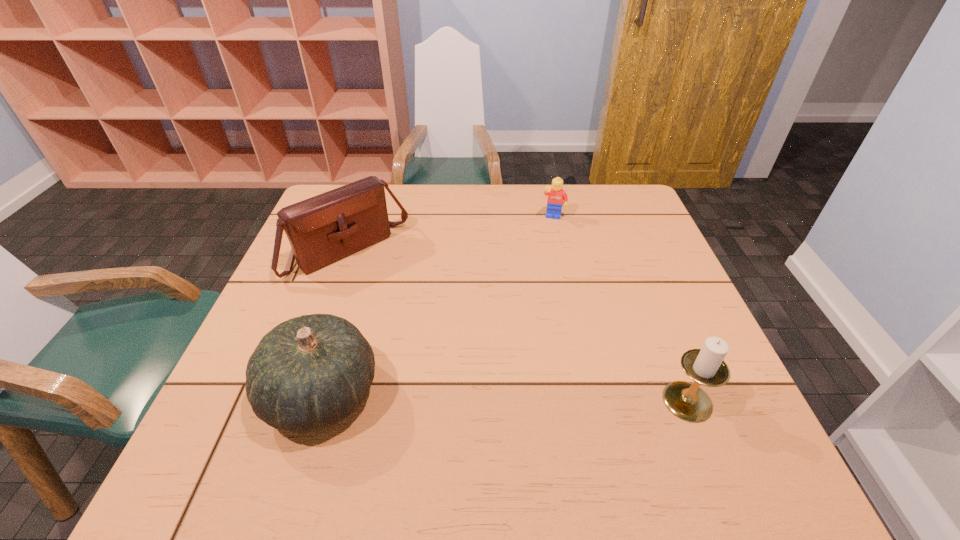
Where is `vacant region between the candle holder and the third object from left to right`? The image size is (960, 540). vacant region between the candle holder and the third object from left to right is located at coordinates (620, 309).

I want to click on vacant area that lies between the rightmost object and the shoulder bag, so click(x=517, y=327).

This screenshot has height=540, width=960. Identify the location of blank region between the second farthest object and the farthest object. tap(451, 235).

Where is `vacant space in between the gourd and the rightmost object`? vacant space in between the gourd and the rightmost object is located at coordinates (505, 397).

Identify the location of unoccupied position between the gourd and the candle holder. (505, 397).

Where is `object that can be found as the third closest to the gourd`? The width and height of the screenshot is (960, 540). object that can be found as the third closest to the gourd is located at coordinates (556, 195).

The height and width of the screenshot is (540, 960). What are the coordinates of `object that stands as the closest to the shoulder bag` in the screenshot? It's located at (308, 373).

Locate an element on the screen. The height and width of the screenshot is (540, 960). free spot that satisfies the following two spatial constraints: 1. on the back side of the farthest object; 2. on the left side of the gourd is located at coordinates (376, 218).

Where is `vacant space that satisfies the following two spatial constraints: 1. on the front side of the farthest object; 2. on the left side of the rightmost object`? vacant space that satisfies the following two spatial constraints: 1. on the front side of the farthest object; 2. on the left side of the rightmost object is located at coordinates (593, 401).

What are the coordinates of `vacant space that satisfies the following two spatial constraints: 1. on the back side of the shoulder bag; 2. on the left side of the farthest object` in the screenshot? It's located at (361, 218).